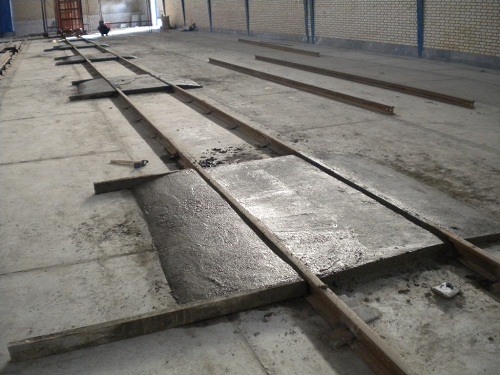
This screenshot has width=500, height=375. Find the location of `light from open door`. light from open door is located at coordinates (125, 29).